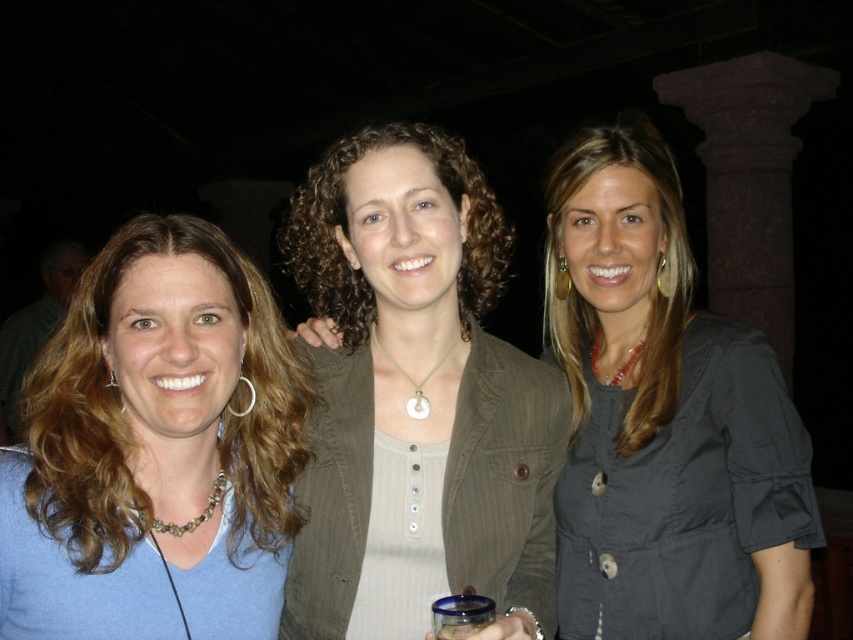
Based on the scene description, where is the matte olive green blazer at center located in terms of its 2D coordinates?

The matte olive green blazer at center is located at the 2D coordinates point (418, 394).

You are a photographer trying to capture a clear photo of the matte olive green blazer at center and the matte black blouse at right. Which one will appear closer to the camera in the photo?

The matte olive green blazer at center will appear closer to the camera because it is positioned in front of the matte black blouse at right.

Based on the scene description, where is the matte olive green blazer at center located in the image?

The matte olive green blazer at center is located at point 0.616 on the x axis and 0.491 on the y axis.